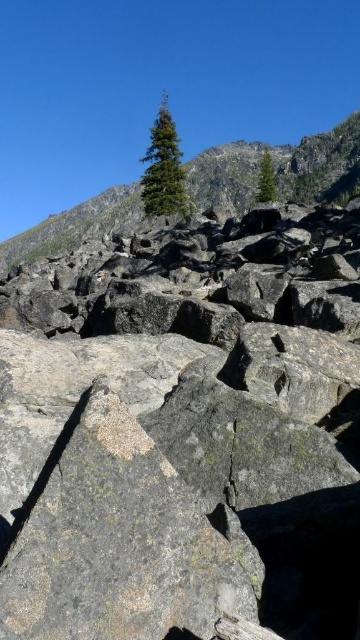
You are a hiker trying to navigate through the rocky terrain. You notice the gray granite rock at center and the green coniferous tree at upper center. Which object is closer to your current position?

The gray granite rock at center is closer to your current position because it is in front of the green coniferous tree at upper center.

You are a hiker trying to reach the summit. You see the gray granite rock at center and the green coniferous tree at upper center. Which one is closer to your current position?

The gray granite rock at center is closer to your current position because it is only 418.49 feet away from the green coniferous tree at upper center, but without knowing the exact distance from your starting point, we can only compare their positions relative to each other. However, since the rock is in the foreground and the tree is at upper center, the rock is likely closer.

You are a hiker planning to cross the rocky terrain. You notice the gray granite rock at center and the green coniferous tree at upper center. Which object has a smaller width that could allow easier passage around it?

The gray granite rock at center has a lesser width compared to the green coniferous tree at upper center, so it would allow easier passage around it.